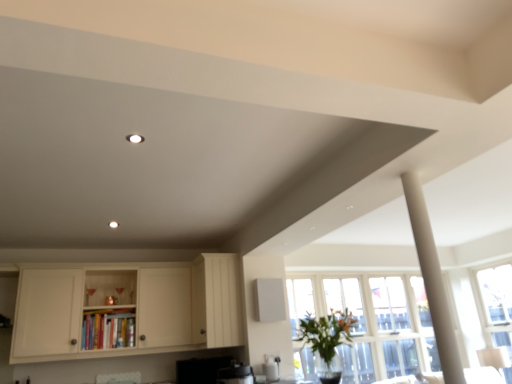
Question: From the image's perspective, is white matte column at right on white wood cabinet at center, which appears as the second cabinetry when viewed from the left?

Choices:
 (A) yes
 (B) no

Answer: (A)

Question: Can you confirm if white matte column at right is bigger than white wood cabinet at center, which appears as the second cabinetry when viewed from the left?

Choices:
 (A) no
 (B) yes

Answer: (A)

Question: Considering the relative positions of white matte column at right and white wood cabinet at center, which appears as the second cabinetry when viewed from the left, in the image provided, is white matte column at right to the right of white wood cabinet at center, which appears as the second cabinetry when viewed from the left, from the viewer's perspective?

Choices:
 (A) yes
 (B) no

Answer: (A)

Question: Can you confirm if white matte column at right is taller than white wood cabinet at center, which appears as the second cabinetry when viewed from the left?

Choices:
 (A) yes
 (B) no

Answer: (A)

Question: From a real-world perspective, is white matte column at right positioned over white wood cabinet at center, which appears as the second cabinetry when viewed from the left, based on gravity?

Choices:
 (A) no
 (B) yes

Answer: (A)

Question: Is white wood cabinet at center, which ranks as the 1th cabinetry in right-to-left order, inside white matte column at right?

Choices:
 (A) no
 (B) yes

Answer: (A)

Question: From a real-world perspective, is white wood cabinet at center, which ranks as the 1th cabinetry in right-to-left order, under white matte column at right?

Choices:
 (A) yes
 (B) no

Answer: (B)

Question: Is white wood cabinet at center, which appears as the second cabinetry when viewed from the left, aimed at white matte column at right?

Choices:
 (A) yes
 (B) no

Answer: (B)

Question: Is white wood cabinet at center, which ranks as the 1th cabinetry in right-to-left order, positioned beyond the bounds of white matte column at right?

Choices:
 (A) yes
 (B) no

Answer: (A)

Question: Is white wood cabinet at center, which ranks as the 1th cabinetry in right-to-left order, positioned behind white matte column at right?

Choices:
 (A) yes
 (B) no

Answer: (A)

Question: Does white wood cabinet at center, which ranks as the 1th cabinetry in right-to-left order, appear on the right side of white matte column at right?

Choices:
 (A) no
 (B) yes

Answer: (A)

Question: Are white wood cabinet at center, which ranks as the 1th cabinetry in right-to-left order, and white matte column at right making contact?

Choices:
 (A) no
 (B) yes

Answer: (A)

Question: Is green leafy plant at lower right wider than white wood cabinet at center, which ranks as the 1th cabinetry in right-to-left order?

Choices:
 (A) yes
 (B) no

Answer: (B)